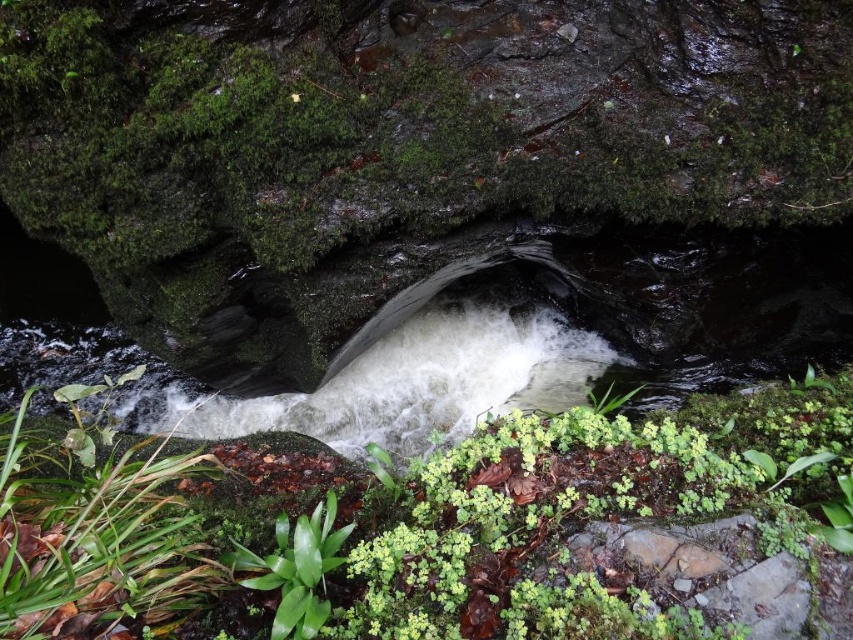
From the picture: You are standing at the edge of the waterfall and see the green leafy plant at center and the green leafy plant at lower left. Which one is closer to your current position?

The green leafy plant at lower left is closer to your current position because it is located below the green leafy plant at center.

You are standing at the bottom of the waterfall and want to reach the green leafy plant at center. Which direction should you move relative to the waterfall to reach it?

The green leafy plant at center is located at the coordinates 0.808 on the x axis and 0.515 on the y axis. Since you are at the bottom of the waterfall, moving towards the center point would require moving upwards and to the right.